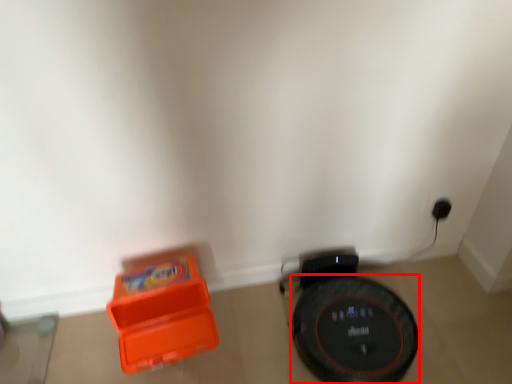
Question: Observing the image, what is the correct spatial positioning of wheel (annotated by the red box) in reference to toy?

Choices:
 (A) left
 (B) right

Answer: (B)